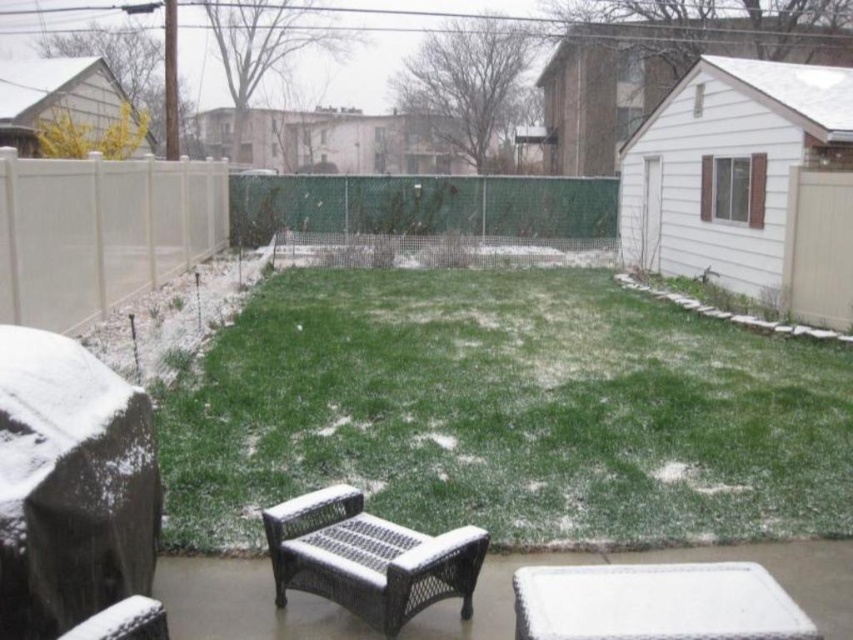
You are standing in the backyard and want to place a small potted plant between the two points, point (636, 508) and point (332, 600). Considering the snow on the ground, will the plant be placed closer to the viewer or further away from the viewer?

The plant will be placed closer to the viewer because point (636, 508) is further to the viewer than point (332, 600), so the midpoint between them would be closer to the viewer than the farther point but still closer than the first point.

You are planning to place a new garden statue in the backyard. The statue requires a clear space in front of the white vinyl fence at upper left. Based on the scene, can you confirm if the green grass at center is suitable for placing the statue there?

The green grass at center is in front of the white vinyl fence at upper left, so placing the statue there would block the view of the fence. Choose another location behind the grass or beside it for better visibility.

In the scene shown: You are standing in the backyard and want to locate the point at coordinates (265, 225). According to the scene description, where exactly is this point located?

The point at coordinates (265, 225) is on the white vinyl fence at upper left.